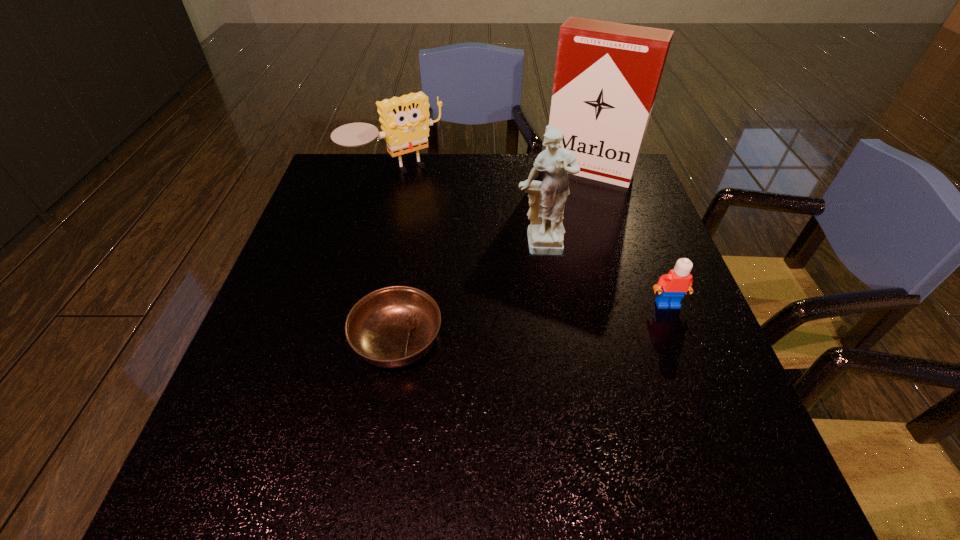
At what (x,y) coordinates should I click in order to perform the action: click on free spot on the desktop that is between the shortest object and the second shortest object and is positioned on the front-facing side of the sponge. Please return your answer as a coordinate pair (x, y). Looking at the image, I should click on pos(516,324).

Image resolution: width=960 pixels, height=540 pixels. Identify the location of free space on the desktop that is between the shortest object and the Lego and is positioned on the front-facing side of the tallest object. (506, 326).

The height and width of the screenshot is (540, 960). Identify the location of vacant spot on the desktop that is between the shortest object and the Lego and is positioned on the front-facing side of the second tallest object. (555, 319).